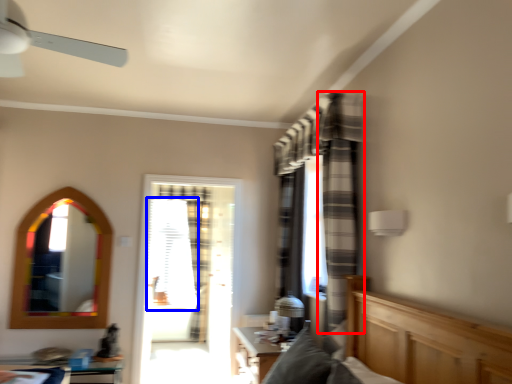
Question: Which point is further to the camera, curtain (highlighted by a red box) or window screen (highlighted by a blue box)?

Choices:
 (A) curtain
 (B) window screen

Answer: (B)